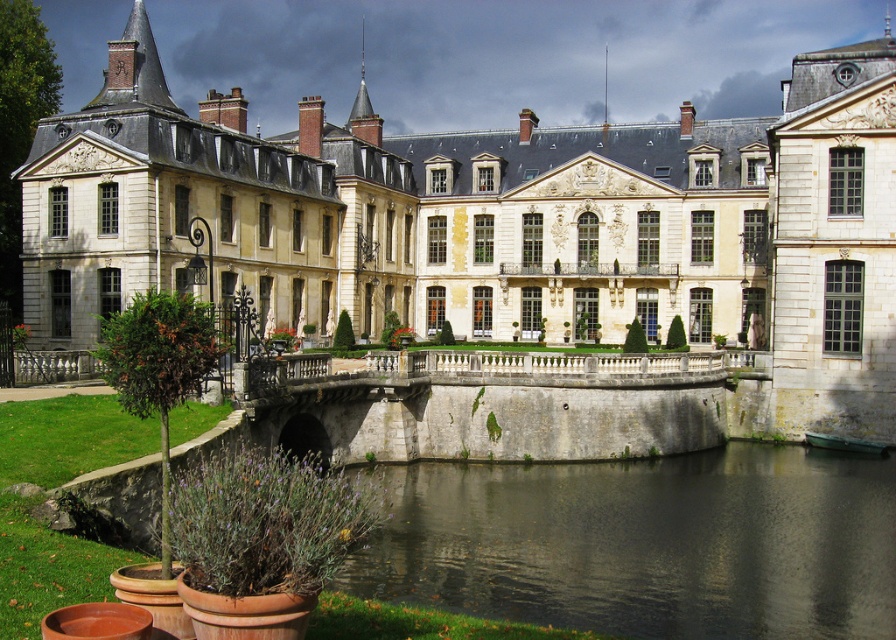
Is white stone palace at center to the left of dark gray stone river at center from the viewer's perspective?

Yes, white stone palace at center is to the left of dark gray stone river at center.

I want to click on white stone palace at center, so click(x=507, y=225).

Between point (744, 308) and point (472, 547), which one is positioned behind?

The point (744, 308) is behind.

The image size is (896, 640). I want to click on white stone palace at center, so click(507, 225).

Who is shorter, dark gray stone river at center or gray stone bridge at center?

dark gray stone river at center is shorter.

Looking at this image, can you confirm if dark gray stone river at center is positioned above gray stone bridge at center?

No, dark gray stone river at center is not above gray stone bridge at center.

Find the location of a particular element. dark gray stone river at center is located at coordinates (645, 541).

Between white stone palace at center and gray stone bridge at center, which one appears on the right side from the viewer's perspective?

Positioned to the right is gray stone bridge at center.

Is white stone palace at center further to camera compared to gray stone bridge at center?

Yes, white stone palace at center is further from the viewer.

Image resolution: width=896 pixels, height=640 pixels. In order to click on white stone palace at center in this screenshot , I will do `click(507, 225)`.

Locate an element on the screen. The image size is (896, 640). white stone palace at center is located at coordinates pyautogui.click(x=507, y=225).